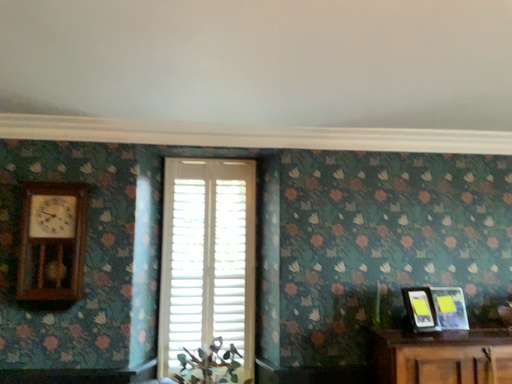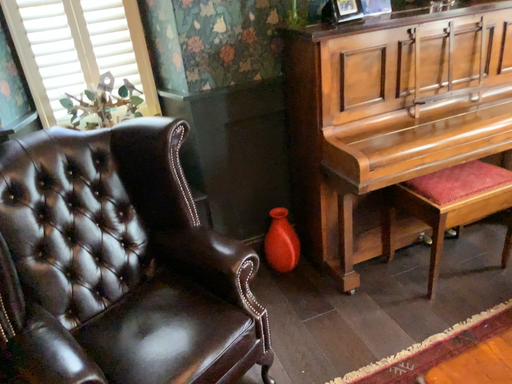
Question: Which way did the camera rotate in the video?

Choices:
 (A) rotated downward
 (B) rotated upward

Answer: (A)